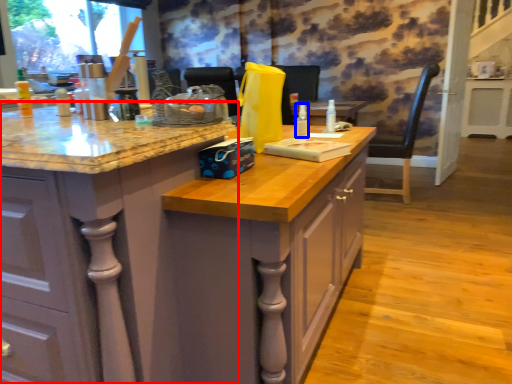
Question: Which of the following is the closest to the observer, cabinetry (highlighted by a red box) or bottle (highlighted by a blue box)?

Choices:
 (A) cabinetry
 (B) bottle

Answer: (A)